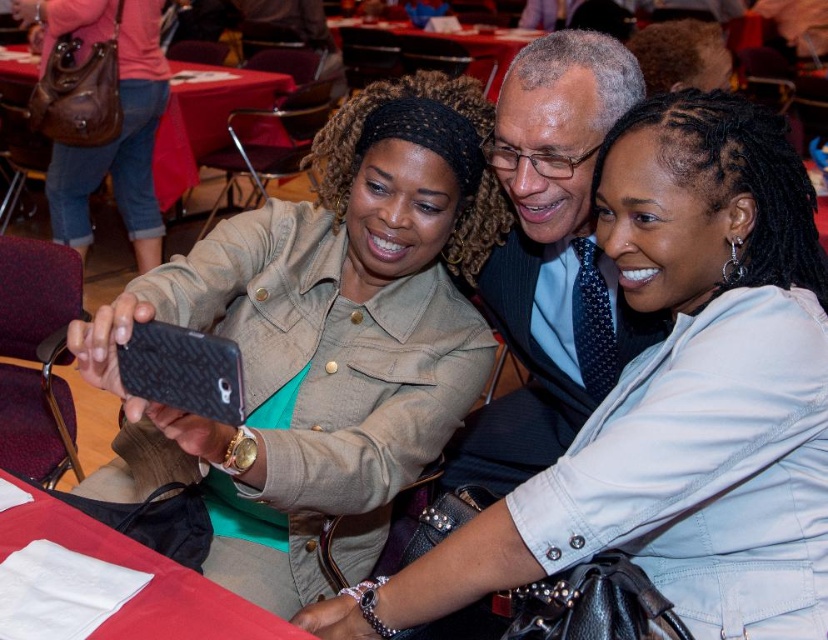
You are a photographer at the event and need to adjust the lighting for the group photo. Since the polished dark blue tie at center and the red cloth table at center are both in the frame, which one requires closer attention to avoid overexposure due to its proximity to the camera?

The polished dark blue tie at center is closer to the viewer than the red cloth table at center, so it requires closer attention to avoid overexposure due to its proximity to the camera.

You are organizing a photo shoot and need to ensure that all props fit within the frame. The camera you are using has a maximum width capacity of 1.2 meters. Given the brown leather purse at upper left and the red cloth table at center, which object will definitely fit within the camera frame?

The brown leather purse at upper left will definitely fit within the camera frame since its width is less than the red cloth table at center, and the camera can accommodate up to 1.2 meters. However, the red cloth table at center may exceed the frame if its width is over 1.2 meters, but we cannot confirm without its exact measurement.